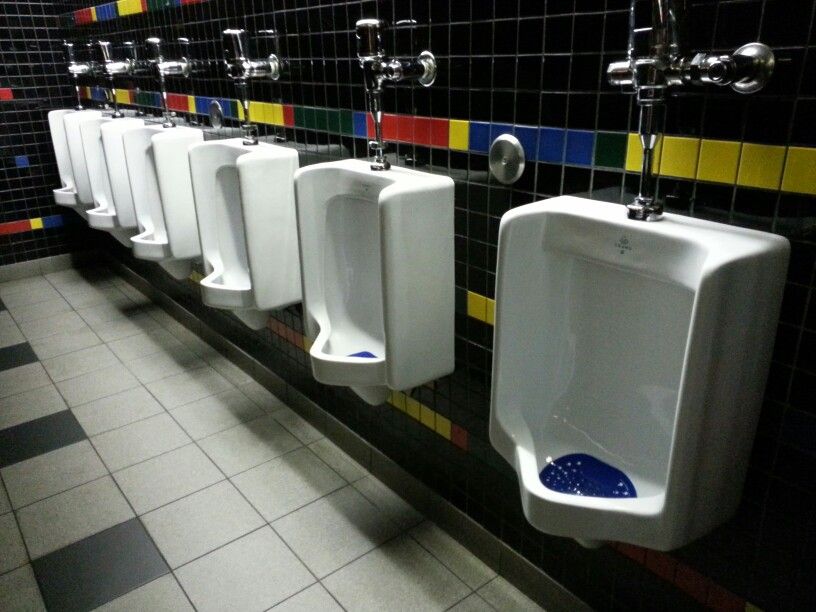
At what (x,y) coordinates should I click in order to perform the action: click on metal top of urinal. Please return your answer as a coordinate pair (x, y). Image resolution: width=816 pixels, height=612 pixels. Looking at the image, I should click on (721, 73), (397, 72), (246, 65), (156, 65), (108, 65), (89, 64).